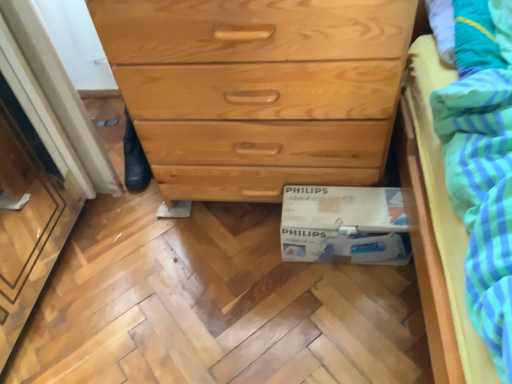
Question: From the image's perspective, relative to white cardboard box at lower center, is natural wood chest of drawers at center above or below?

Choices:
 (A) below
 (B) above

Answer: (B)

Question: In the image, is natural wood chest of drawers at center positioned in front of or behind white cardboard box at lower center?

Choices:
 (A) front
 (B) behind

Answer: (A)

Question: Choose the correct answer: Is natural wood chest of drawers at center inside white cardboard box at lower center or outside it?

Choices:
 (A) outside
 (B) inside

Answer: (A)

Question: Looking at their shapes, would you say white cardboard box at lower center is wider or thinner than natural wood chest of drawers at center?

Choices:
 (A) wide
 (B) thin

Answer: (B)

Question: Considering the relative positions of white cardboard box at lower center and natural wood chest of drawers at center in the image provided, is white cardboard box at lower center to the left or to the right of natural wood chest of drawers at center?

Choices:
 (A) left
 (B) right

Answer: (B)

Question: From the image's perspective, relative to natural wood chest of drawers at center, is white cardboard box at lower center above or below?

Choices:
 (A) below
 (B) above

Answer: (A)

Question: Is white cardboard box at lower center inside the boundaries of natural wood chest of drawers at center, or outside?

Choices:
 (A) outside
 (B) inside

Answer: (A)